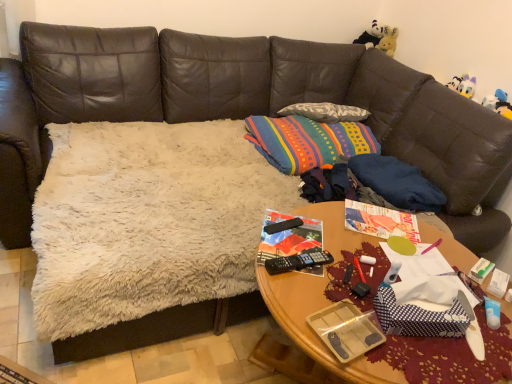
Find the location of `unoccupied region to the right of black plastic remote control at center`. unoccupied region to the right of black plastic remote control at center is located at coordinates (310, 237).